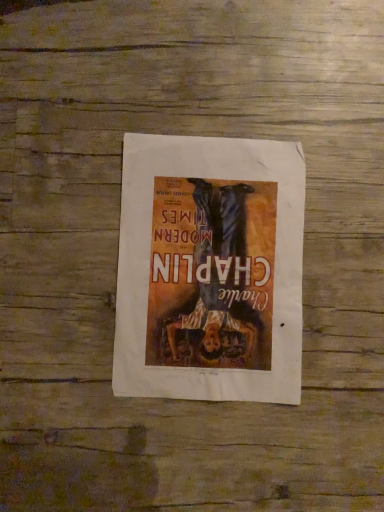
Question: Should I look upward or downward to see matte paper poster at center?

Choices:
 (A) down
 (B) up

Answer: (A)